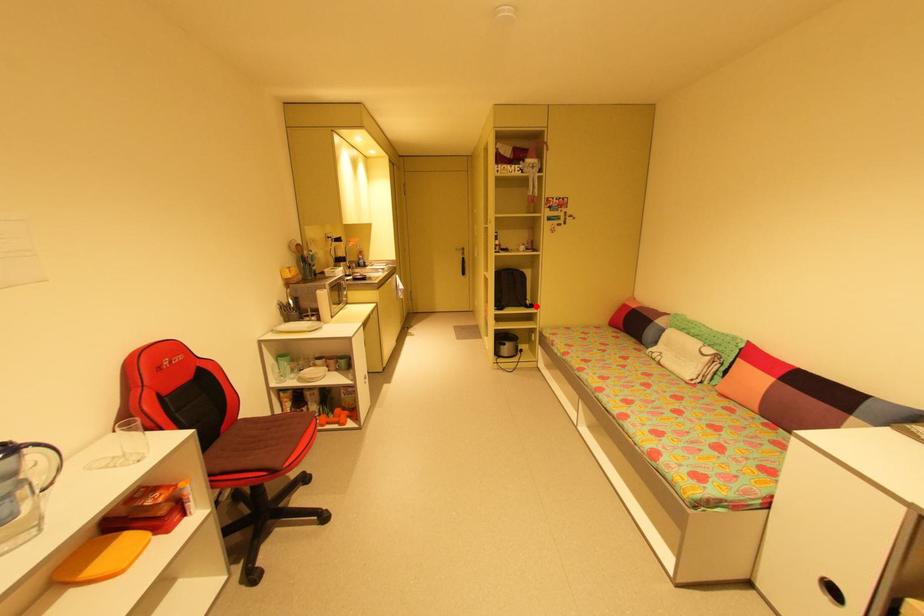
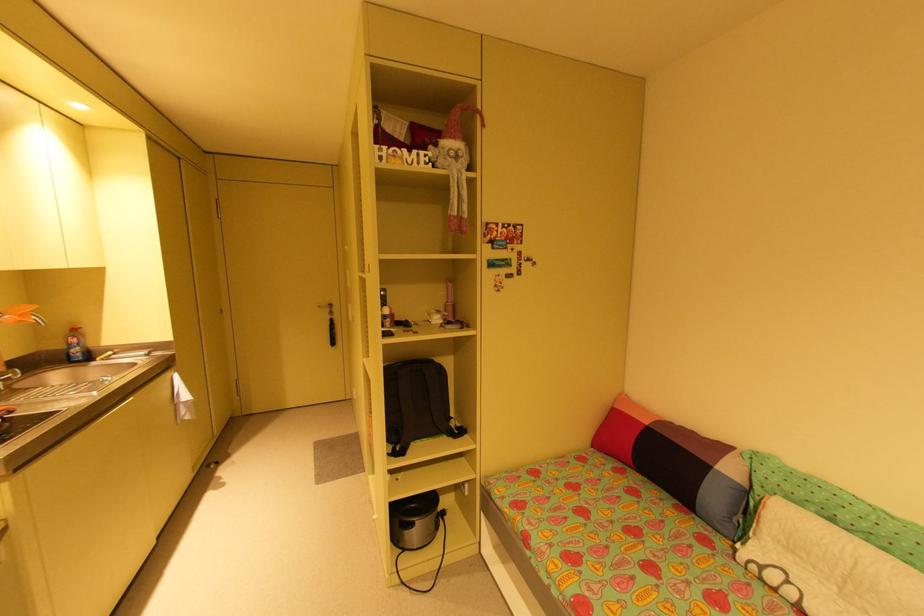
Find the pixel in the second image that matches the highlighted location in the first image.

(466, 431)